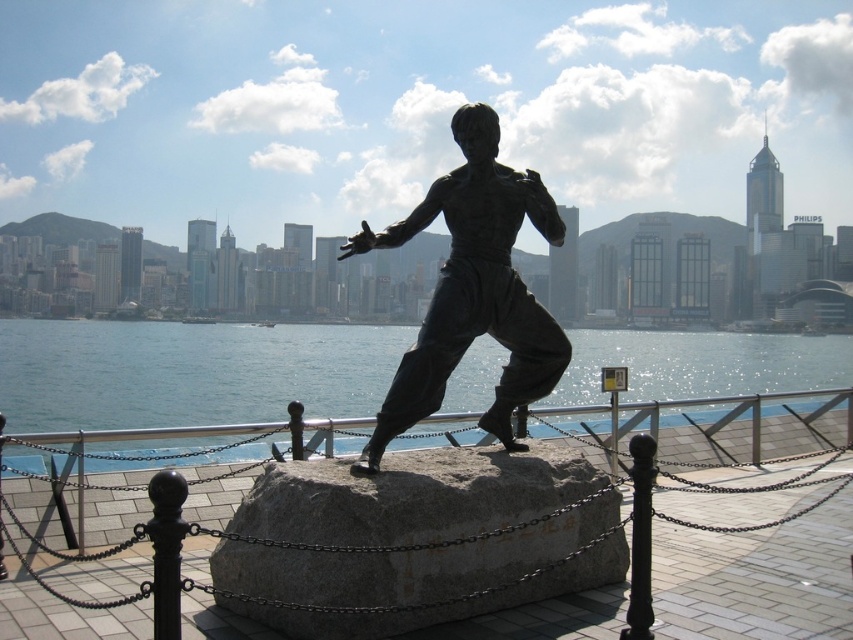
Can you confirm if gray granite stone at center is thinner than bronze statue at center?

No.

Which is more to the left, gray granite stone at center or bronze statue at center?

Positioned to the left is gray granite stone at center.

At what (x,y) coordinates should I click in order to perform the action: click on gray granite stone at center. Please return your answer as a coordinate pair (x, y). The image size is (853, 640). Looking at the image, I should click on (413, 496).

Does clear blue water at center have a lesser width compared to bronze statue at center?

Incorrect, clear blue water at center's width is not less than bronze statue at center's.

Is clear blue water at center wider than bronze statue at center?

Yes, clear blue water at center is wider than bronze statue at center.

Does point (79, 401) come in front of point (425, 371)?

No, (79, 401) is further to viewer.

Find the location of `clear blue water at center`. clear blue water at center is located at coordinates (186, 371).

Is gray granite stone at center shorter than clear blue water at center?

Correct, gray granite stone at center is not as tall as clear blue water at center.

Can you confirm if gray granite stone at center is positioned below clear blue water at center?

No, gray granite stone at center is not below clear blue water at center.

This screenshot has width=853, height=640. Find the location of `gray granite stone at center`. gray granite stone at center is located at coordinates (413, 496).